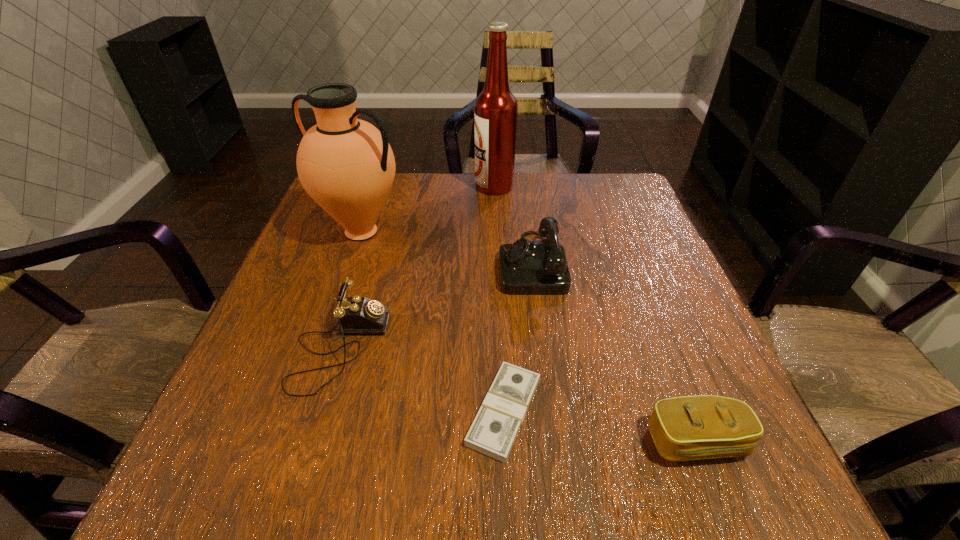
You are a GUI agent. You are given a task and a screenshot of the screen. Output one action in this format:
    pyautogui.click(x=<x>, y=<y>)
    Task: Click on the vacant region located 0.280m on the label side of the tallest object
    
    Given the screenshot: What is the action you would take?
    pyautogui.click(x=376, y=186)

At what (x,y) coordinates should I click in order to perform the action: click on free space located 0.330m on the label side of the tallest object. Please return your answer as a coordinate pair (x, y). The width and height of the screenshot is (960, 540). Looking at the image, I should click on (359, 186).

This screenshot has width=960, height=540. I want to click on free spot located 0.300m on the front of the pitcher, so click(316, 366).

At what (x,y) coordinates should I click in order to perform the action: click on free region located on the dial of the right telephone. Please return your answer as a coordinate pair (x, y). This screenshot has width=960, height=540. Looking at the image, I should click on (415, 263).

The height and width of the screenshot is (540, 960). Find the location of `vacant area situated 0.090m on the dial of the right telephone`. vacant area situated 0.090m on the dial of the right telephone is located at coordinates (459, 263).

I want to click on vacant space situated on the dial of the right telephone, so click(x=433, y=263).

This screenshot has height=540, width=960. What are the coordinates of `free point located 0.200m on the dial of the fourth tallest object` in the screenshot? It's located at (492, 348).

At what (x,y) coordinates should I click in order to perform the action: click on vacant region located on the left of the shortest object. Please return your answer as a coordinate pair (x, y). Looking at the image, I should click on (228, 411).

At what (x,y) coordinates should I click in order to perform the action: click on alcohol that is at the far edge. Please return your answer as a coordinate pair (x, y). This screenshot has height=540, width=960. Looking at the image, I should click on (495, 117).

Locate an element on the screen. The width and height of the screenshot is (960, 540). pitcher positioned at the far edge is located at coordinates (347, 166).